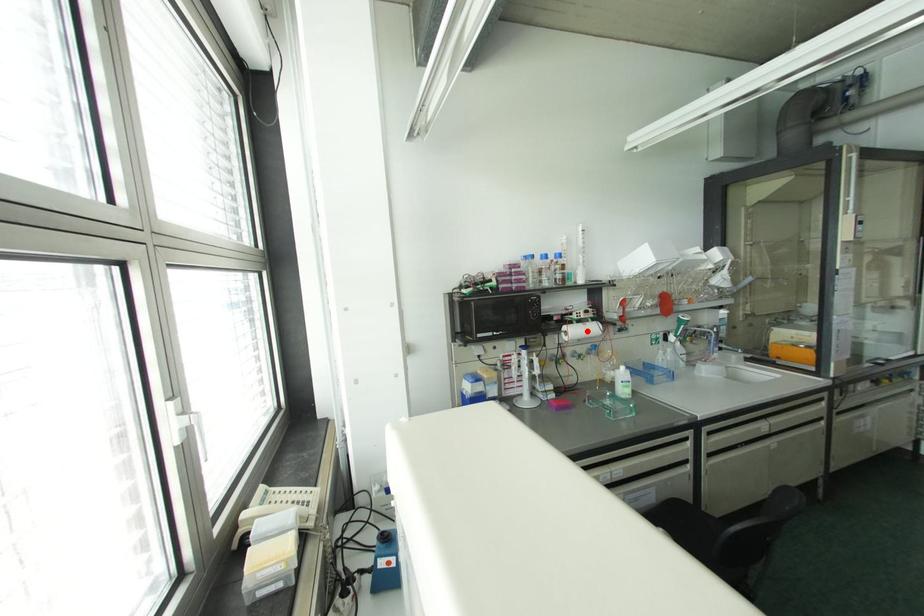
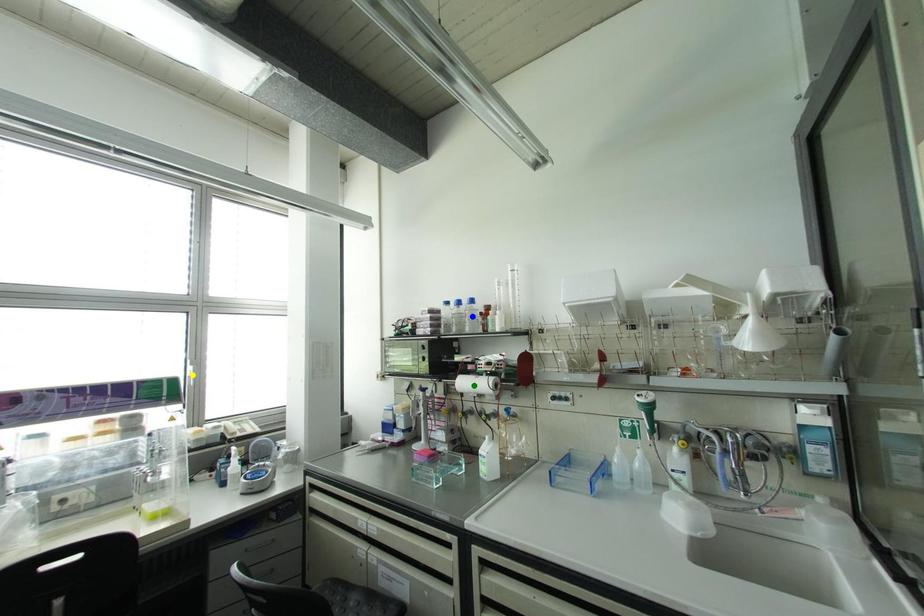
Question: I am providing you with two images of the same scene from different viewpoints. A red point is marked on the first image. You are given multiple points on the second image. Which point in image 2 represents the same 3d spot as the red point in image 1?

Choices:
 (A) yellow point
 (B) blue point
 (C) green point

Answer: (C)